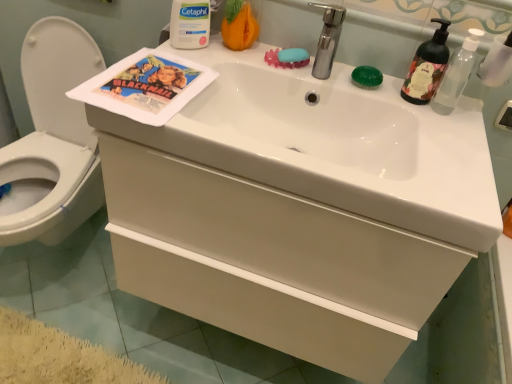
Where is `free spot to the right of white matte cetaphil container at upper center`? The width and height of the screenshot is (512, 384). free spot to the right of white matte cetaphil container at upper center is located at coordinates (239, 54).